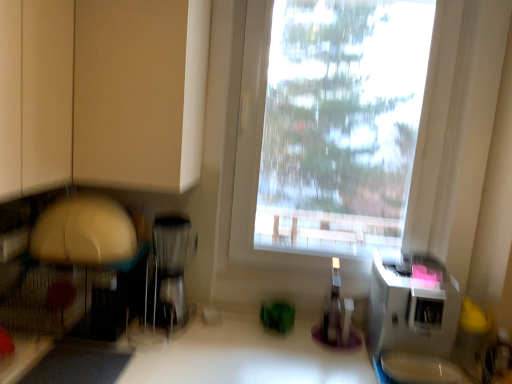
The height and width of the screenshot is (384, 512). What are the coordinates of `vacant space situated above white plastic microwave at right, which ranks as the first appliance in right-to-left order (from a real-world perspective)` in the screenshot? It's located at (417, 281).